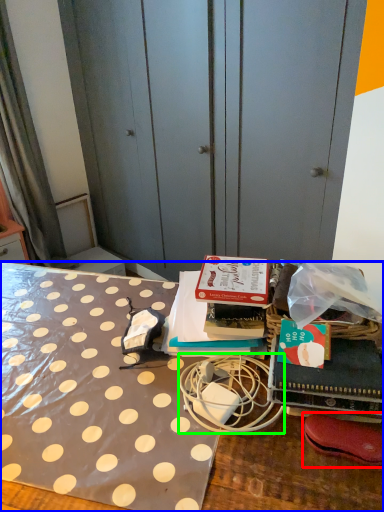
Question: Which is nearer to the footwear (highlighted by a red box)? desk (highlighted by a blue box) or twin (highlighted by a green box).

Choices:
 (A) desk
 (B) twin

Answer: (B)